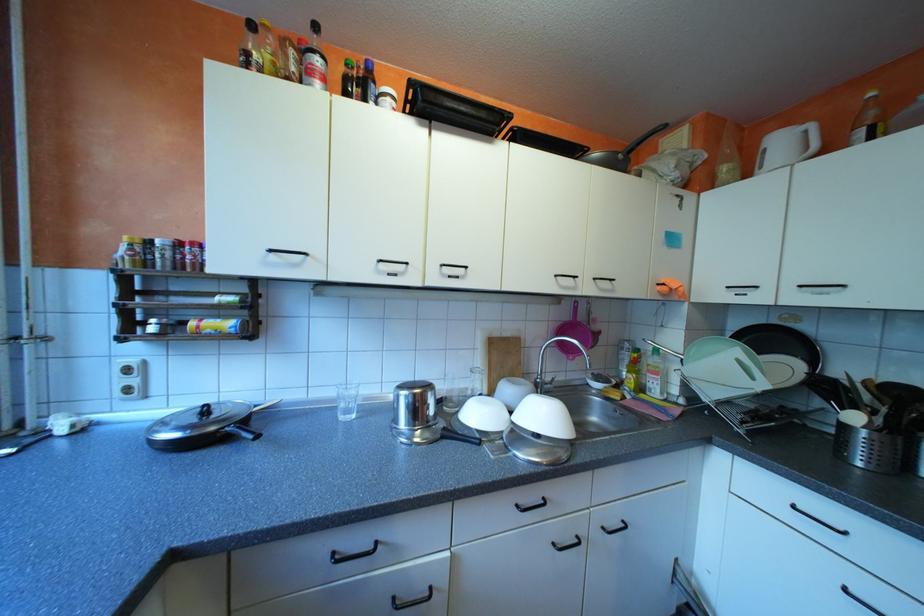
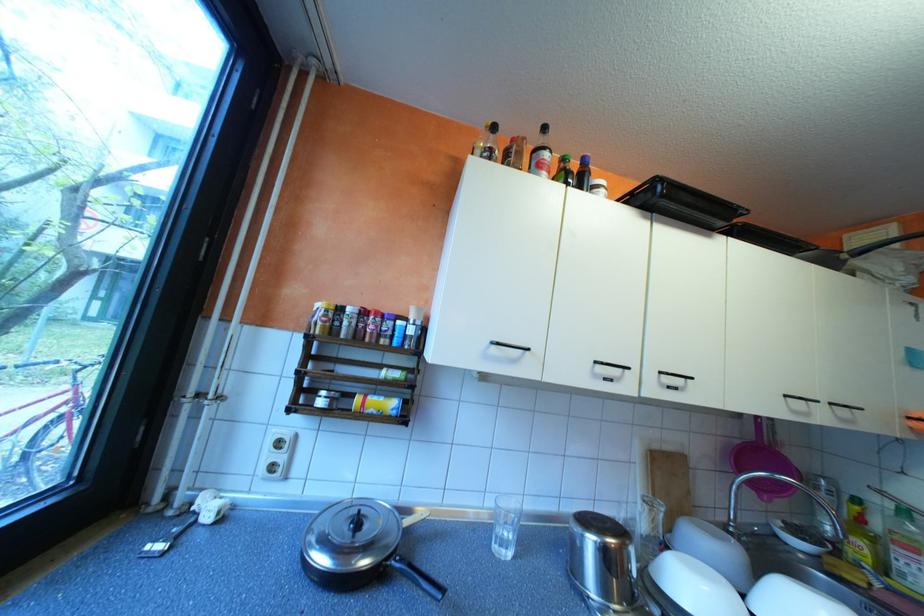
In the second image, find the point that corresponds to [606,278] in the first image.

(843, 403)